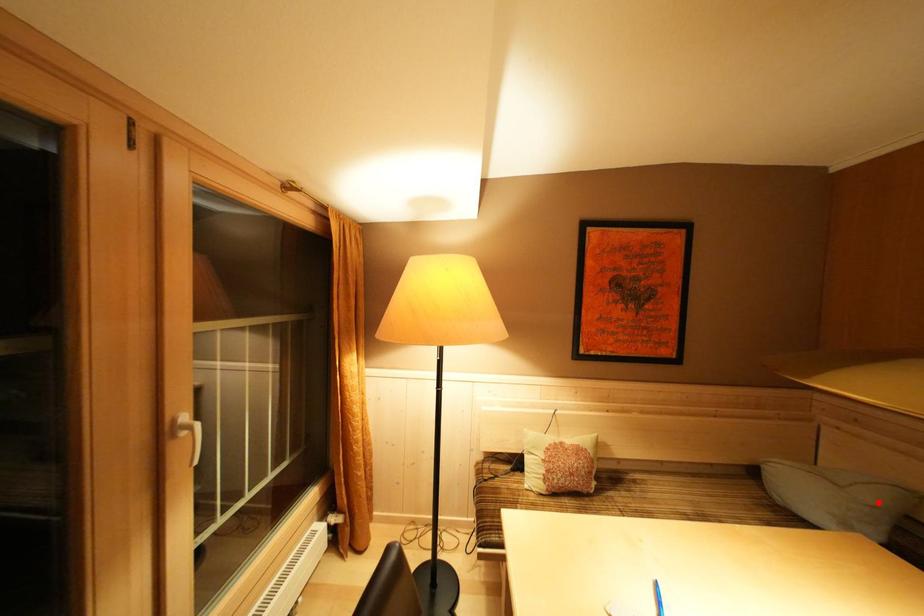
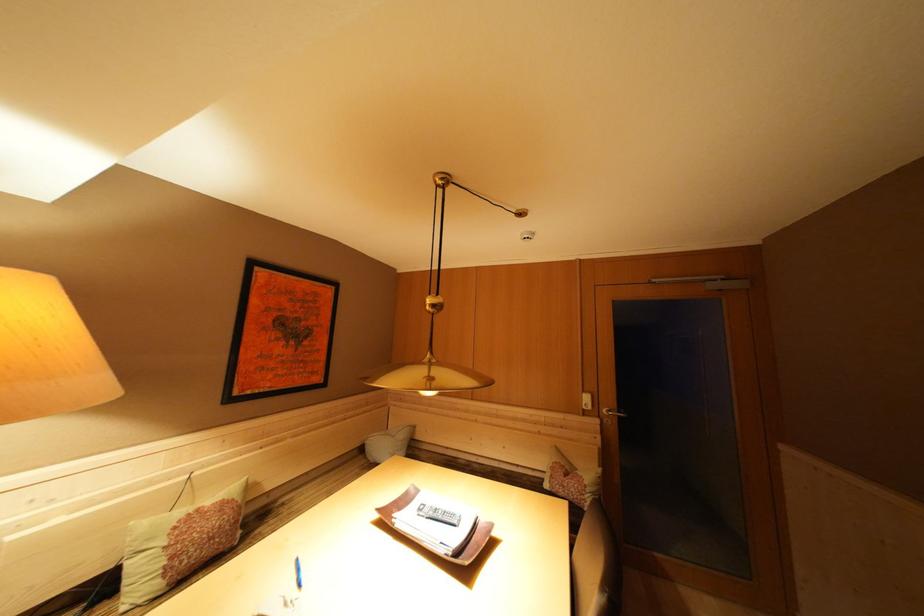
Question: A red point is marked in image1. In image2, is the corresponding 3D point closer to the camera or farther? Reply with the corresponding letter.

Choices:
 (A) The corresponding 3D point is closer.
 (B) The corresponding 3D point is farther.

Answer: (B)